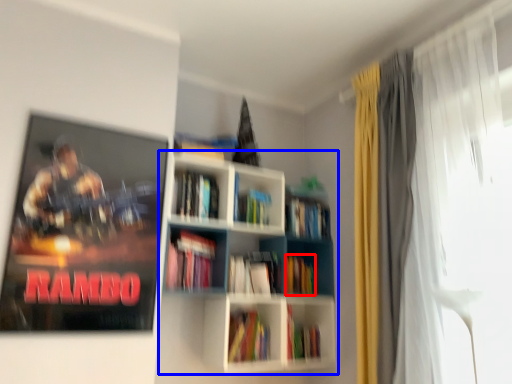
Question: Which of the following is the closest to the observer, book (highlighted by a red box) or bookcase (highlighted by a blue box)?

Choices:
 (A) book
 (B) bookcase

Answer: (B)